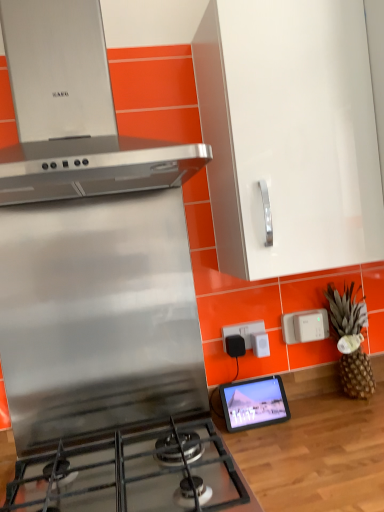
Describe the element at coordinates (289, 134) in the screenshot. I see `white glossy cabinet at upper center` at that location.

The image size is (384, 512). Identify the location of satin silver range hood at upper left. (77, 113).

What do you see at coordinates (133, 473) in the screenshot?
I see `stainless steel gas stove at lower left` at bounding box center [133, 473].

What do you see at coordinates (97, 315) in the screenshot? I see `stainless steel stove at center` at bounding box center [97, 315].

Where is `white plastic electric outlet at right, marked as the second electric outlet in a left-to-right arrangement`? The image size is (384, 512). white plastic electric outlet at right, marked as the second electric outlet in a left-to-right arrangement is located at coordinates (305, 326).

The height and width of the screenshot is (512, 384). Find the location of `black plastic outlet at center, the first electric outlet in the left-to-right sequence`. black plastic outlet at center, the first electric outlet in the left-to-right sequence is located at coordinates (249, 337).

Between stainless steel stove at center and brown textured pineapple at right, which one appears on the right side from the viewer's perspective?

Positioned to the right is brown textured pineapple at right.

From a real-world perspective, between stainless steel stove at center and brown textured pineapple at right, who is vertically lower?

brown textured pineapple at right.

From the image's perspective, relative to white plastic power strip at center, is white plastic electric outlet at right, marked as the second electric outlet in a left-to-right arrangement, above or below?

white plastic electric outlet at right, marked as the second electric outlet in a left-to-right arrangement, is situated higher than white plastic power strip at center in the image.

Is the depth of white plastic electric outlet at right, marked as the second electric outlet in a left-to-right arrangement, less than that of white plastic power strip at center?

No, it is behind white plastic power strip at center.

Between point (312, 319) and point (266, 334), which one is positioned in front?

The point (266, 334) is more forward.

Looking at this image, how distant is white plastic electric outlet at right, marked as the second electric outlet in a left-to-right arrangement, from white plastic power strip at center?

5.23 inches.

Is brown textured pineapple at right wider or thinner than black plastic outlet at center, the first electric outlet in the left-to-right sequence?

brown textured pineapple at right is wider than black plastic outlet at center, the first electric outlet in the left-to-right sequence.

How many degrees apart are the facing directions of brown textured pineapple at right and black plastic outlet at center, which is the 2th electric outlet in right-to-left order?

The angular difference between brown textured pineapple at right and black plastic outlet at center, which is the 2th electric outlet in right-to-left order, is 0.0108 degrees.

Considering the relative positions of brown textured pineapple at right and black plastic outlet at center, which is the 2th electric outlet in right-to-left order, in the image provided, is brown textured pineapple at right behind black plastic outlet at center, which is the 2th electric outlet in right-to-left order,?

No, it is not.

Is point (356, 313) closer or farther from the camera than point (258, 326)?

Point (356, 313) appears to be farther away from the viewer than point (258, 326).

Looking at this image, does white glossy cabinet at upper center have a smaller size compared to satin silver range hood at upper left?

Yes, white glossy cabinet at upper center is smaller than satin silver range hood at upper left.

Would you consider white glossy cabinet at upper center to be distant from satin silver range hood at upper left?

white glossy cabinet at upper center is actually quite close to satin silver range hood at upper left.

Which is nearer, (326, 60) or (96, 104)?

The point (96, 104) is closer to the camera.

Which object is further away from the camera taking this photo, stainless steel stove at center or white glossy cabinet at upper center?

stainless steel stove at center is further away from the camera.

In the scene shown: Which of these two, stainless steel stove at center or white glossy cabinet at upper center, is wider?

white glossy cabinet at upper center.

Measure the distance from stainless steel stove at center to white glossy cabinet at upper center.

They are 19.45 inches apart.

From the image's perspective, between white glossy cabinet at upper center and white plastic electric outlet at right, marked as the second electric outlet in a left-to-right arrangement, who is located below?

white plastic electric outlet at right, marked as the second electric outlet in a left-to-right arrangement, from the image's perspective.

From a real-world perspective, between white glossy cabinet at upper center and white plastic electric outlet at right, marked as the second electric outlet in a left-to-right arrangement, who is vertically lower?

white plastic electric outlet at right, marked as the second electric outlet in a left-to-right arrangement, from a real-world perspective.

Considering the sizes of objects white glossy cabinet at upper center and white plastic electric outlet at right, which is the 1th electric outlet in right-to-left order, in the image provided, who is wider, white glossy cabinet at upper center or white plastic electric outlet at right, which is the 1th electric outlet in right-to-left order,?

With larger width is white glossy cabinet at upper center.

Is matte black tablet at center in front of or behind brown textured pineapple at right in the image?

matte black tablet at center is in front of brown textured pineapple at right.

From a real-world perspective, relative to brown textured pineapple at right, is matte black tablet at center vertically above or below?

From a real-world perspective, matte black tablet at center is physically below brown textured pineapple at right.

Looking at this image, is matte black tablet at center not near brown textured pineapple at right?

No.

Is matte black tablet at center inside or outside of brown textured pineapple at right?

matte black tablet at center is located beyond the bounds of brown textured pineapple at right.

Identify the location of pineapple below the stainless steel stove at center (from the image's perspective). (351, 342).

From the image's perspective, which electric outlet is the 2nd one above the white plastic power strip at center? Please provide its 2D coordinates.

[(305, 326)]

Based on their spatial positions, is white plastic power strip at center or brown textured pineapple at right closer to black plastic outlet at center, the first electric outlet in the left-to-right sequence?

The object closer to black plastic outlet at center, the first electric outlet in the left-to-right sequence, is white plastic power strip at center.

Which object lies further to the anchor point matte black tablet at center, stainless steel gas stove at lower left or black plastic outlet at center, which is the 2th electric outlet in right-to-left order?

→ stainless steel gas stove at lower left lies further to matte black tablet at center than the other object.

Looking at the image, which one is located further to stainless steel gas stove at lower left, white glossy cabinet at upper center or matte black tablet at center?

Among the two, white glossy cabinet at upper center is located further to stainless steel gas stove at lower left.

Consider the image. Considering their positions, is brown textured pineapple at right positioned closer to stainless steel stove at center than white plastic power strip at center?

Among the two, white plastic power strip at center is located nearer to stainless steel stove at center.

Estimate the real-world distances between objects in this image. Which object is further from matte black tablet at center, satin silver range hood at upper left or stainless steel gas stove at lower left?

satin silver range hood at upper left is further to matte black tablet at center.

Based on their spatial positions, is satin silver range hood at upper left or white glossy cabinet at upper center closer to white plastic electric outlet at right, which is the 1th electric outlet in right-to-left order?

white glossy cabinet at upper center lies closer to white plastic electric outlet at right, which is the 1th electric outlet in right-to-left order, than the other object.

From the image, which object appears to be farther from stainless steel stove at center, brown textured pineapple at right or matte black tablet at center?

brown textured pineapple at right lies further to stainless steel stove at center than the other object.

Considering their positions, is black plastic outlet at center, which is the 2th electric outlet in right-to-left order, positioned further to stainless steel stove at center than stainless steel gas stove at lower left?

black plastic outlet at center, which is the 2th electric outlet in right-to-left order, is positioned further to the anchor stainless steel stove at center.

Where is `tablet computer situated between stainless steel stove at center and brown textured pineapple at right from left to right`? The height and width of the screenshot is (512, 384). tablet computer situated between stainless steel stove at center and brown textured pineapple at right from left to right is located at coordinates (254, 403).

The height and width of the screenshot is (512, 384). Identify the location of electric outlet between stainless steel gas stove at lower left and white plastic electric outlet at right, which is the 1th electric outlet in right-to-left order, in the front-back direction. (249, 337).

The height and width of the screenshot is (512, 384). I want to click on appliance situated between matte black tablet at center and brown textured pineapple at right from left to right, so click(x=260, y=344).

This screenshot has width=384, height=512. Find the location of `home appliance between stainless steel stove at center and white plastic electric outlet at right, which is the 1th electric outlet in right-to-left order`. home appliance between stainless steel stove at center and white plastic electric outlet at right, which is the 1th electric outlet in right-to-left order is located at coordinates (77, 113).